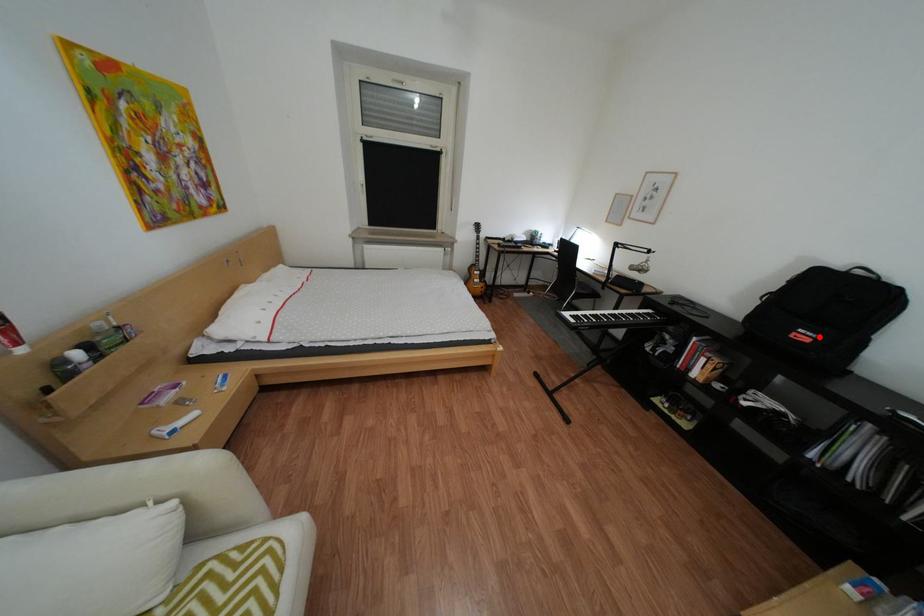
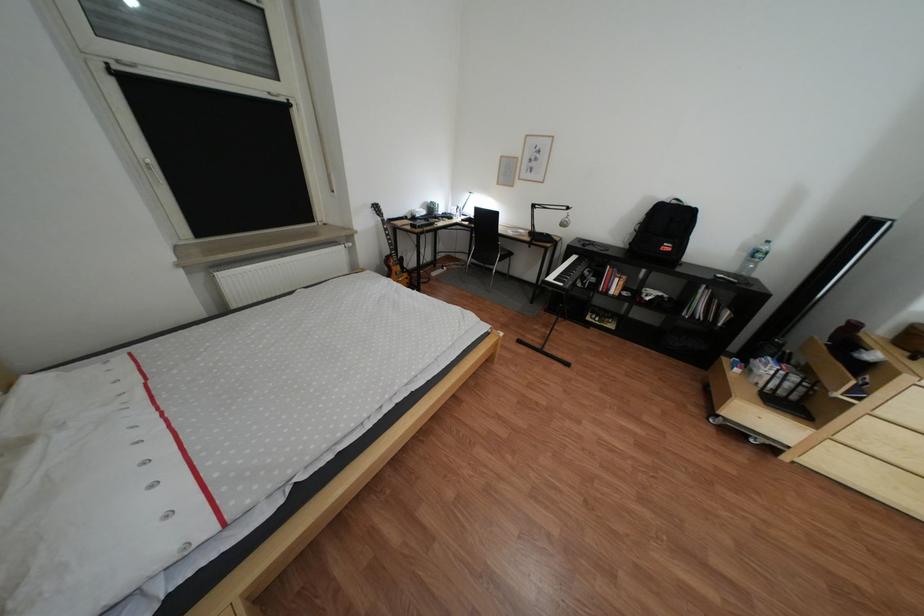
Where in the second image is the point corresponding to the highlighted location from the first image?

(683, 248)